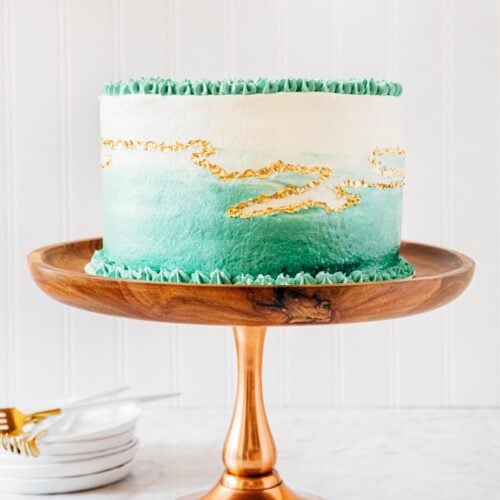
You are a GUI agent. You are given a task and a screenshot of the screen. Output one action in this format:
    pyautogui.click(x=<x>, y=<y>)
    Task: Click on the stand
    The width and height of the screenshot is (500, 500).
    Given the screenshot: What is the action you would take?
    pyautogui.click(x=248, y=440)